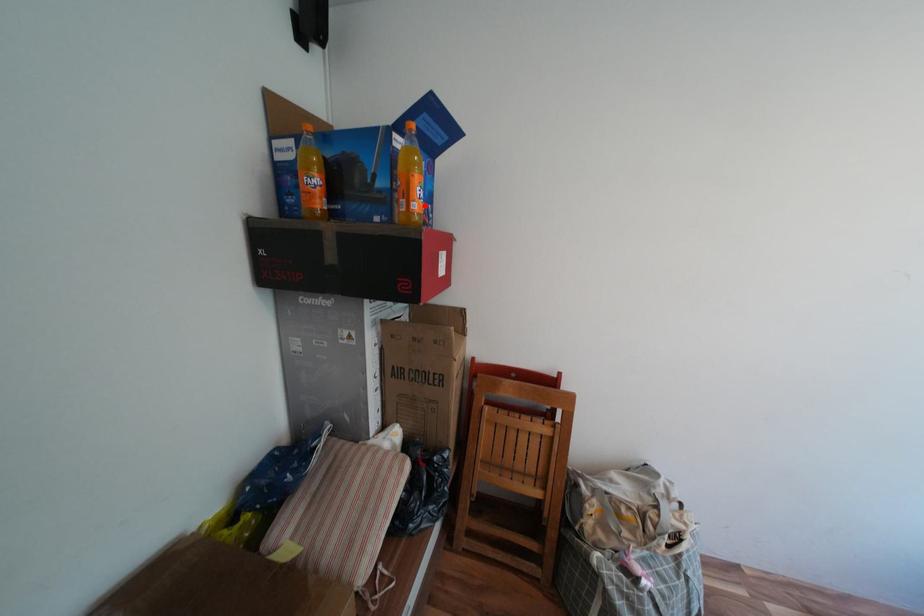
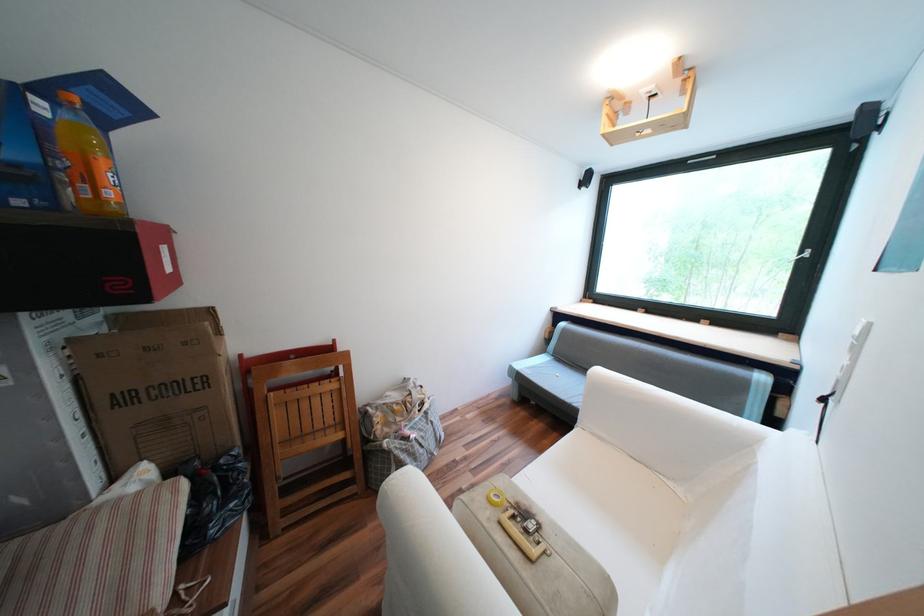
In the second image, find the point that corresponds to the highlighted location in the first image.

(118, 193)